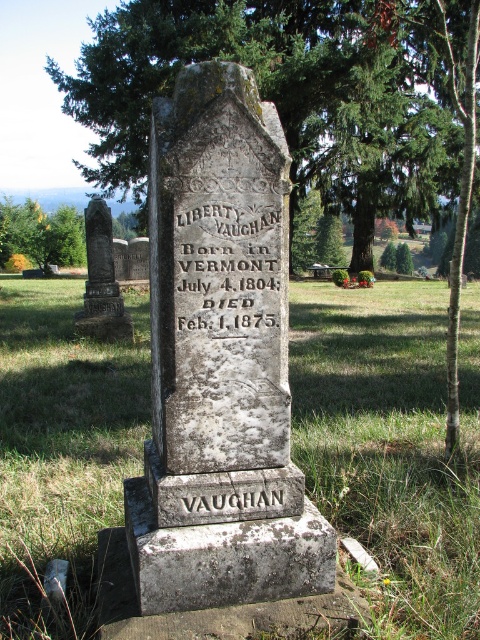
Question: Based on their relative distances, which object is nearer to the rusty metal gravestone at left?

Choices:
 (A) green leafy tree at center
 (B) green grass at center
 (C) bronze plaque at center
 (D) green leafy tree at left

Answer: (B)

Question: Can you confirm if rusty metal gravestone at left is smaller than bronze plaque at center?

Choices:
 (A) no
 (B) yes

Answer: (A)

Question: Among these objects, which one is farthest from the camera?

Choices:
 (A) green grass at center
 (B) green leafy tree at center
 (C) green leafy tree at left
 (D) rusty metal gravestone at left

Answer: (C)

Question: Does green grass at center appear on the right side of bronze plaque at center?

Choices:
 (A) no
 (B) yes

Answer: (B)

Question: Which object is positioned closest to the carved stone inscription at center?

Choices:
 (A) rusty metal gravestone at left
 (B) green grass at center

Answer: (B)

Question: Can you confirm if green grass at center is positioned above green leafy tree at center?

Choices:
 (A) yes
 (B) no

Answer: (B)